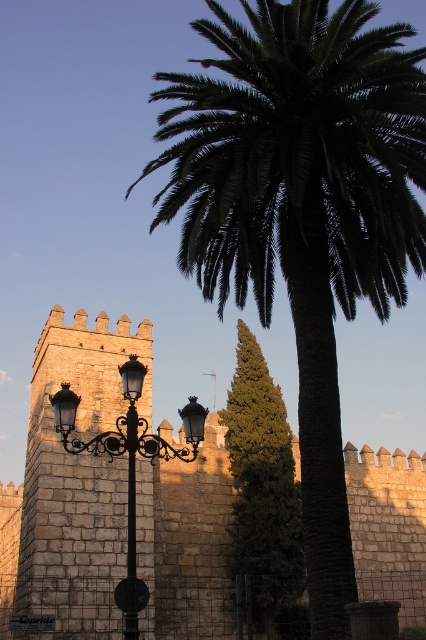
Based on the coordinates provided, which object is located at point (71, 486) in the image?

The point (71, 486) indicates the location of the stone wall at center.

Consider the image. You are a tourist standing in front of the palm tree and looking at the stone wall at center and the black wrought iron street light at center. Which object is positioned higher from the ground?

The black wrought iron street light at center is positioned higher from the ground than the stone wall at center because the stone wall at center is below it.